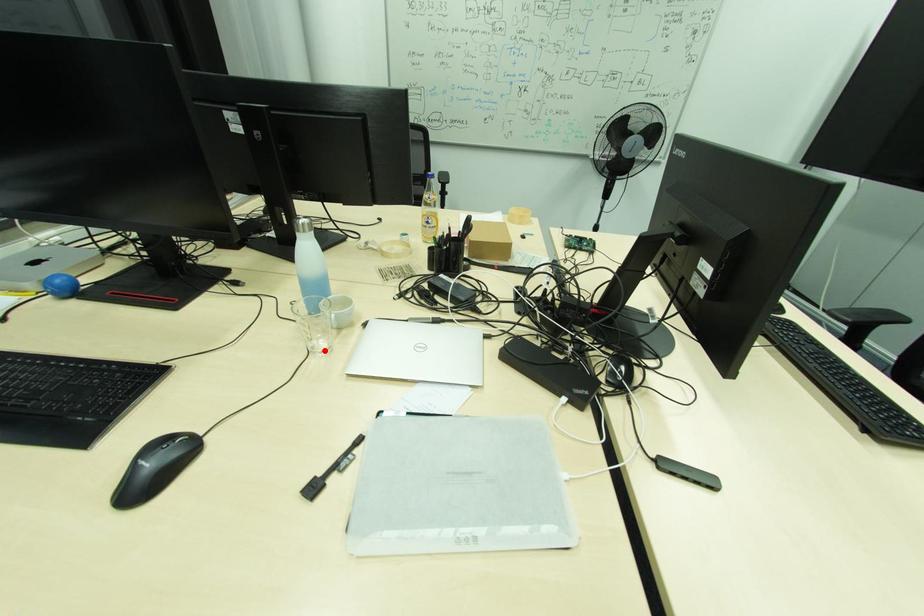
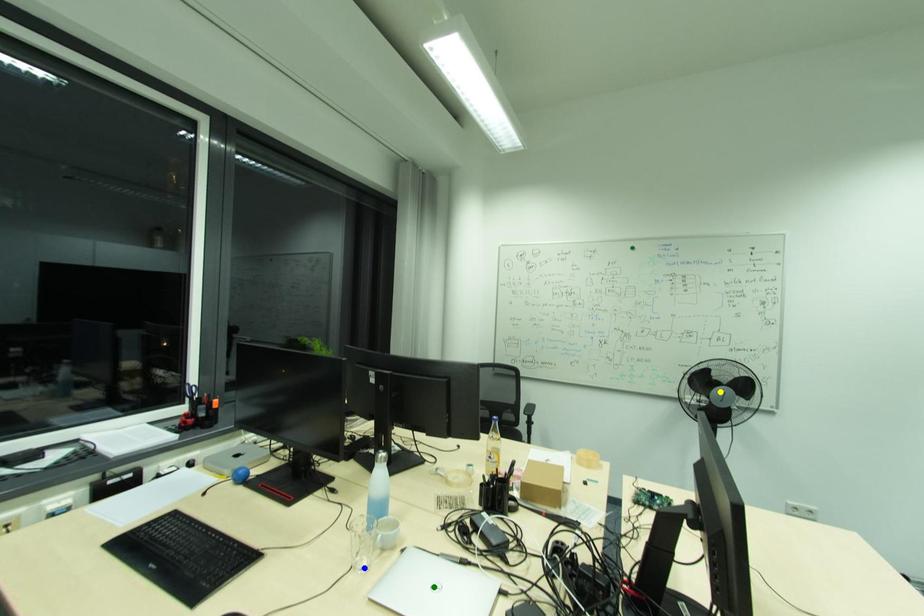
Question: I am providing you with two images of the same scene from different viewpoints. A red point is marked on the first image. You are given multiple points on the second image. Can you choose the point in image 2 that corresponds to the point in image 1?

Choices:
 (A) green point
 (B) yellow point
 (C) blue point

Answer: (C)